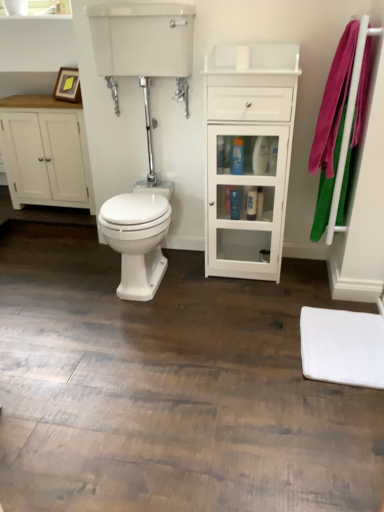
This screenshot has height=512, width=384. I want to click on free point below pink fabric bath towel at right (from a real-world perspective), so pyautogui.click(x=319, y=276).